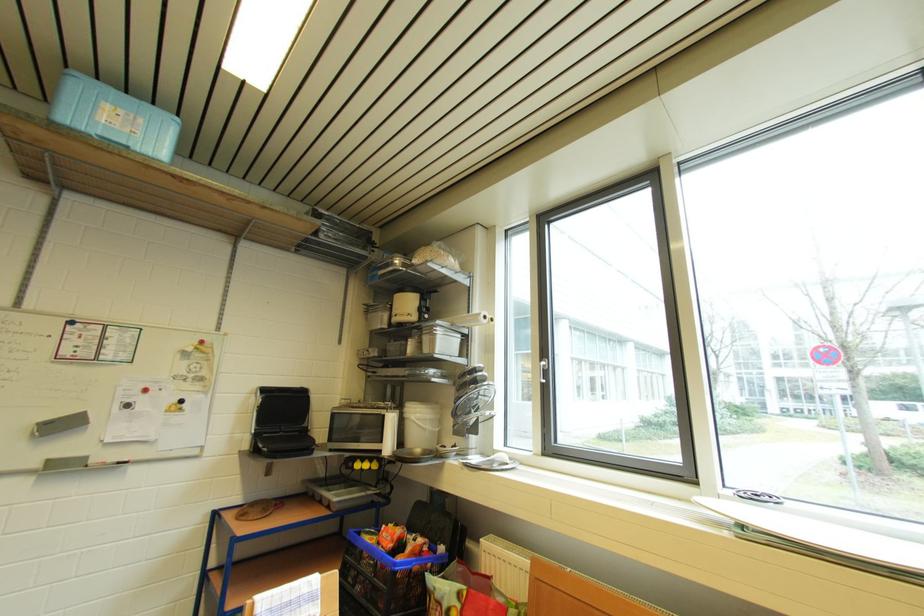
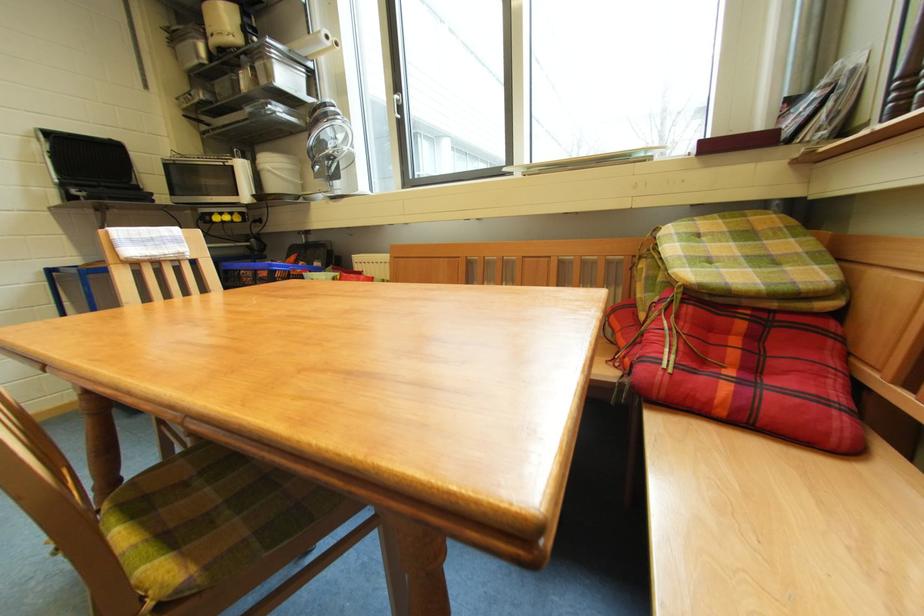
The point at (484, 323) is marked in the first image. Where is the corresponding point in the second image?

(326, 44)